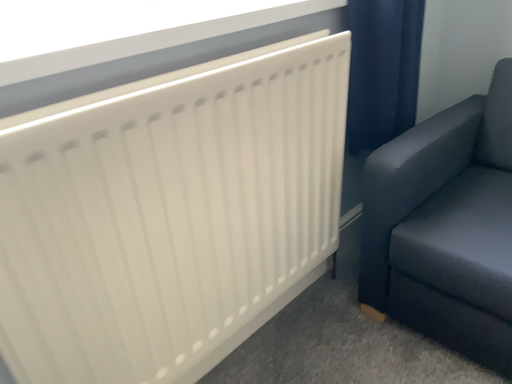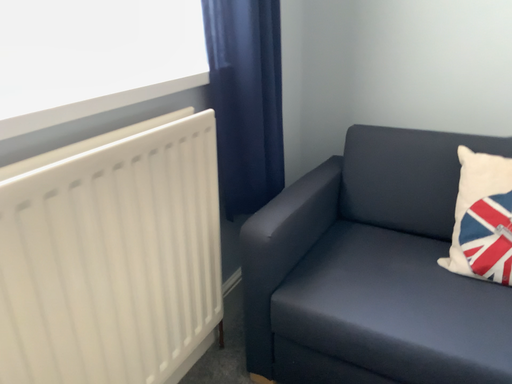
Question: Which way did the camera rotate in the video?

Choices:
 (A) rotated left
 (B) rotated right

Answer: (B)